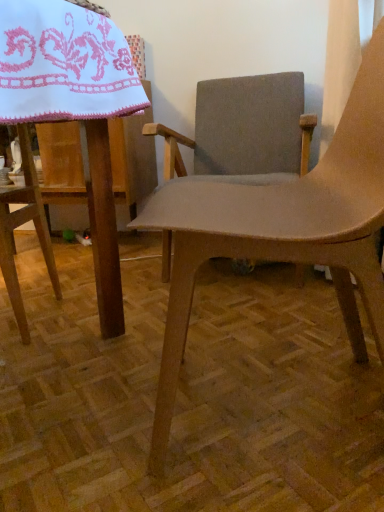
Question: Which is correct: white embroidered cloth at upper left is inside textured gray fabric chair at center, arranged as the second chair when viewed from the front, or outside of it?

Choices:
 (A) inside
 (B) outside

Answer: (B)

Question: Is white embroidered cloth at upper left in front of or behind textured gray fabric chair at center, the first chair when ordered from back to front, in the image?

Choices:
 (A) behind
 (B) front

Answer: (B)

Question: Which of these objects is positioned farthest from the matte brown chair at center, the 1th chair when ordered from front to back?

Choices:
 (A) white embroidered cloth at upper left
 (B) textured gray fabric chair at center, the first chair when ordered from back to front

Answer: (B)

Question: Estimate the real-world distances between objects in this image. Which object is closer to the matte brown chair at center, the 1th chair when ordered from front to back?

Choices:
 (A) white embroidered cloth at upper left
 (B) textured gray fabric chair at center, arranged as the second chair when viewed from the front

Answer: (A)